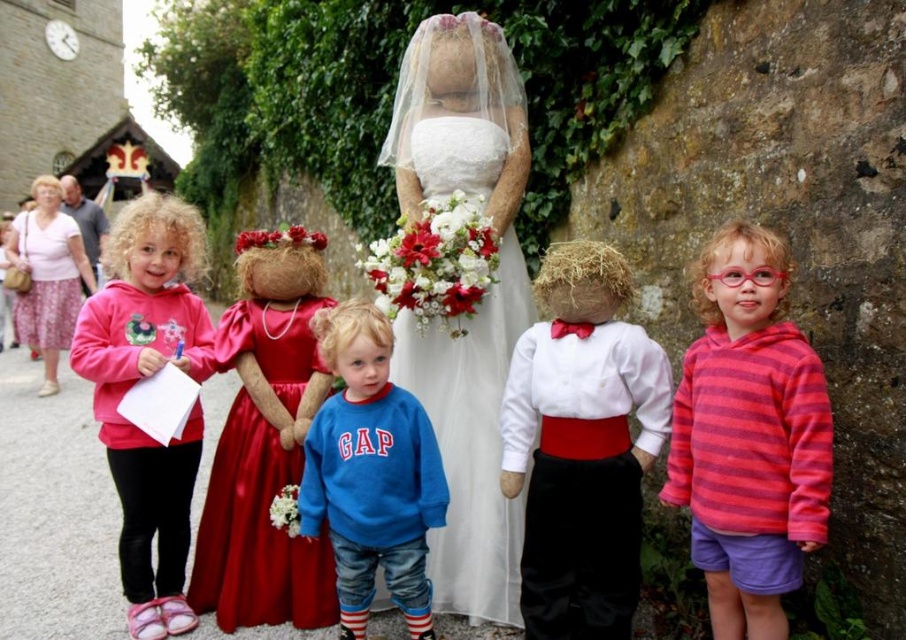
You are organizing a costume party and need to ensure all outfits fit through a narrow doorway. The white cotton shirt at center and the satin red dress at center are both in the center. Which outfit might have difficulty passing through if the doorway has a width restriction?

The satin red dress at center is wider than the white cotton shirt at center, so it might have difficulty passing through the narrow doorway.

You are a photographer trying to capture a photo of the two central figures wearing the white cotton shirt at center and the satin red dress at center. Based on their positions, which one should you focus on first to ensure both are in frame?

The white cotton shirt at center is to the right of the satin red dress at center, so you should focus on the satin red dress at center first to ensure both are in frame.

You are a photographer trying to capture a group photo of the white cotton shirt at center and the pink fleece hoodie at center. Which one should you focus on first if you want to start from the left side of the group?

The photographer should focus on the pink fleece hoodie at center first since it is positioned on the left side of the white cotton shirt at center.